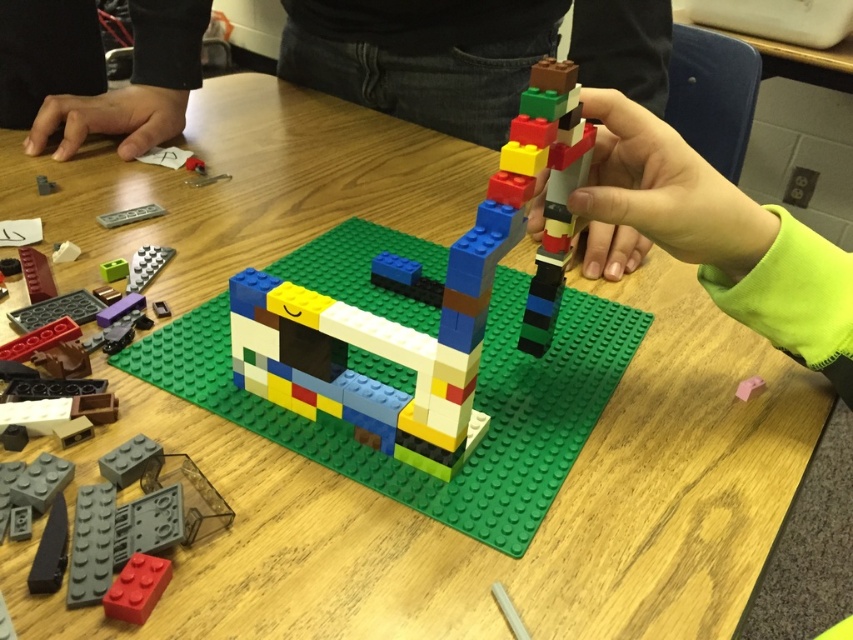
Who is lower down, multicolored plastic blocks at center or black fabric hand at upper left?

Answer: multicolored plastic blocks at center is below.

Who is positioned more to the left, multicolored plastic blocks at center or black fabric hand at upper left?

black fabric hand at upper left is more to the left.

Is point (343, 401) more distant than point (144, 29)?

No, it is in front of (144, 29).

The width and height of the screenshot is (853, 640). In order to click on multicolored plastic blocks at center in this screenshot , I will do `click(425, 301)`.

Can you confirm if multicolored plastic blocks at center is thinner than pink rubber eraser at center?

In fact, multicolored plastic blocks at center might be wider than pink rubber eraser at center.

Describe the element at coordinates (425, 301) in the screenshot. Image resolution: width=853 pixels, height=640 pixels. I see `multicolored plastic blocks at center` at that location.

You are a GUI agent. You are given a task and a screenshot of the screen. Output one action in this format:
    pyautogui.click(x=<x>, y=<y>)
    Task: Click on the multicolored plastic blocks at center
    This screenshot has height=640, width=853.
    Given the screenshot: What is the action you would take?
    pyautogui.click(x=425, y=301)

Can you confirm if black fabric hand at upper left is positioned to the right of pink rubber eraser at center?

No, black fabric hand at upper left is not to the right of pink rubber eraser at center.

Where is `black fabric hand at upper left`? The width and height of the screenshot is (853, 640). black fabric hand at upper left is located at coordinates (96, 72).